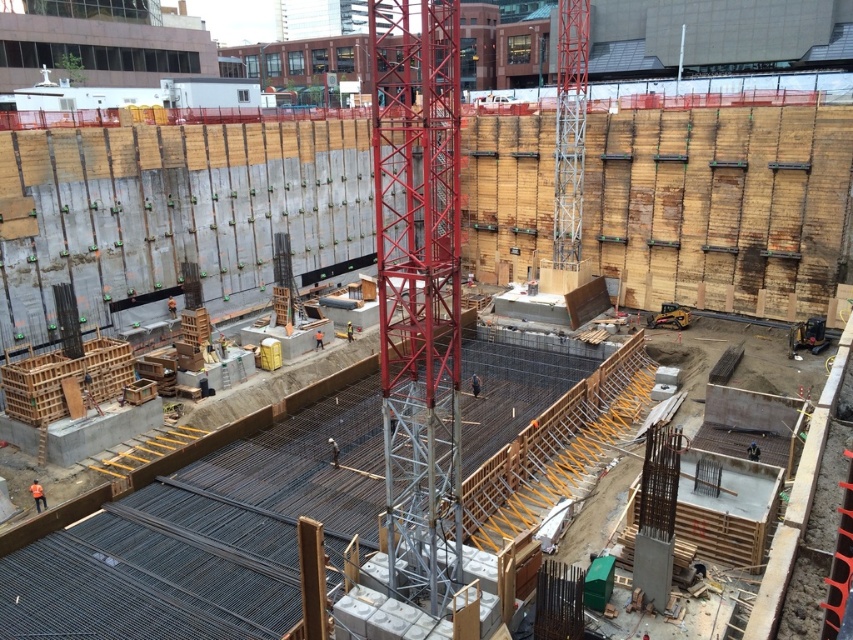
Question: Which of the following is the farthest from the observer?

Choices:
 (A) metallic red tower crane at center
 (B) concrete rebar at center

Answer: (B)

Question: Does concrete rebar at center have a smaller size compared to metallic red tower crane at center?

Choices:
 (A) no
 (B) yes

Answer: (B)

Question: Is concrete rebar at center above metallic red tower crane at center?

Choices:
 (A) yes
 (B) no

Answer: (B)

Question: Which of the following is the closest to the observer?

Choices:
 (A) metallic red tower crane at center
 (B) concrete rebar at center

Answer: (A)

Question: Is concrete rebar at center behind metallic red tower crane at center?

Choices:
 (A) yes
 (B) no

Answer: (A)